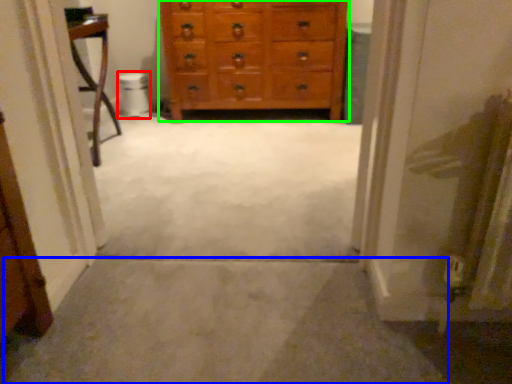
Question: Which object is positioned closest to toilet bowl (highlighted by a red box)? Select from path (highlighted by a blue box) and chest of drawers (highlighted by a green box).

Choices:
 (A) path
 (B) chest of drawers

Answer: (B)